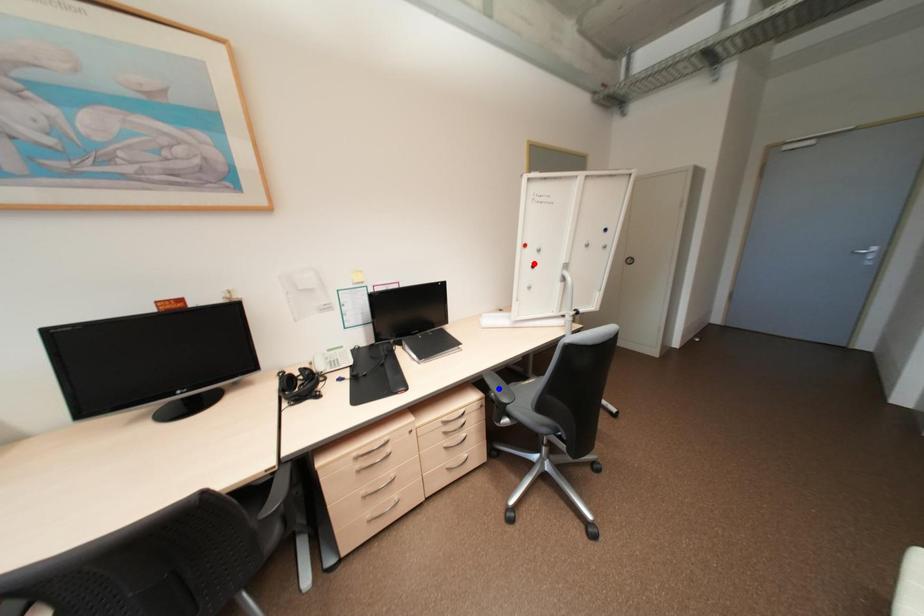
Question: Two points are marked on the image. Which point is closer to the camera?

Choices:
 (A) Blue point is closer.
 (B) Red point is closer.

Answer: (A)